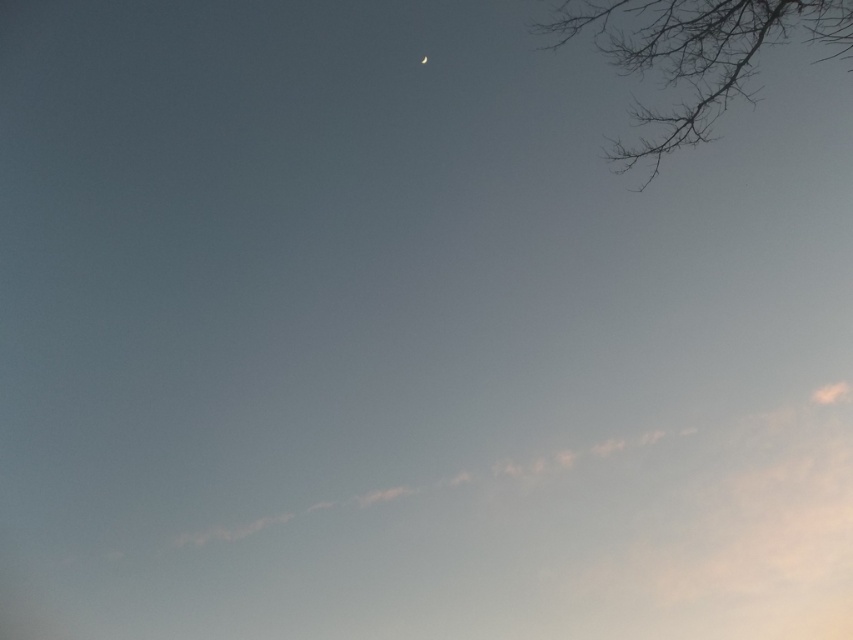
Who is lower down, dark gray branches at upper right or silver metallic crescent moon at upper center?

dark gray branches at upper right is lower down.

Locate an element on the screen. The height and width of the screenshot is (640, 853). dark gray branches at upper right is located at coordinates (695, 52).

The width and height of the screenshot is (853, 640). What do you see at coordinates (695, 52) in the screenshot? I see `dark gray branches at upper right` at bounding box center [695, 52].

At what (x,y) coordinates should I click in order to perform the action: click on dark gray branches at upper right. Please return your answer as a coordinate pair (x, y). The height and width of the screenshot is (640, 853). Looking at the image, I should click on coord(695,52).